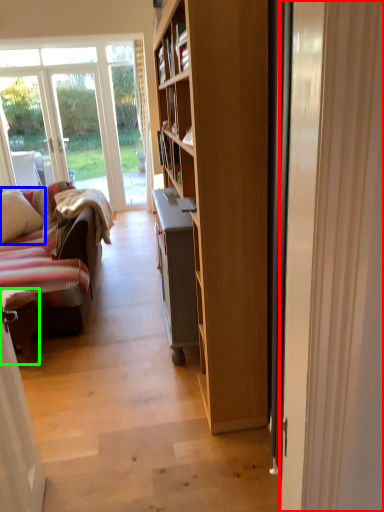
Question: Which is nearer to the door (highlighted by a red box)? pillow (highlighted by a blue box) or chair (highlighted by a green box).

Choices:
 (A) pillow
 (B) chair

Answer: (B)